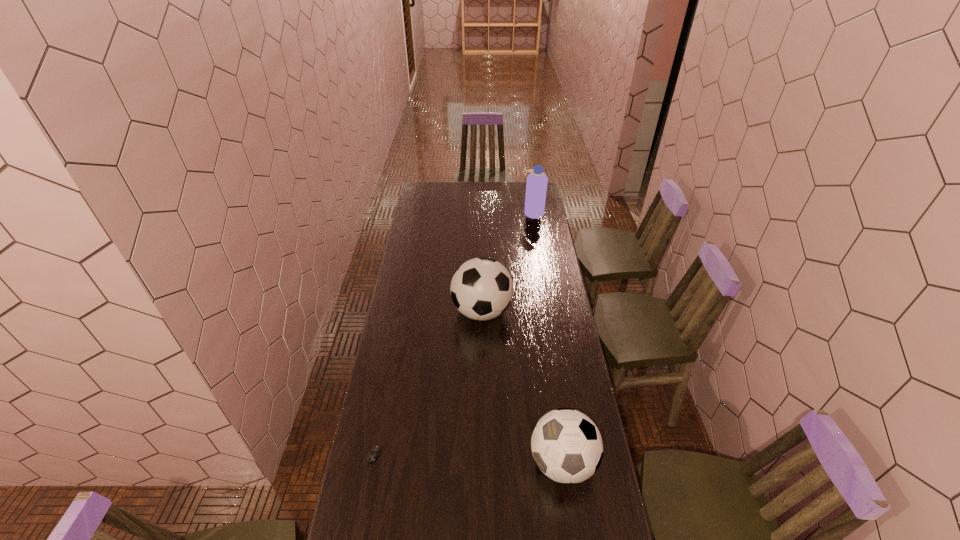
The width and height of the screenshot is (960, 540). What are the coordinates of `the farthest object` in the screenshot? It's located at (536, 186).

Where is `the second farthest object`? This screenshot has height=540, width=960. the second farthest object is located at coordinates (481, 288).

The height and width of the screenshot is (540, 960). I want to click on the farther soccer ball, so click(x=481, y=288).

The image size is (960, 540). I want to click on the right soccer ball, so click(x=566, y=445).

I want to click on the shorter soccer ball, so click(x=566, y=445).

Where is `the shortest object`? Image resolution: width=960 pixels, height=540 pixels. the shortest object is located at coordinates (375, 451).

This screenshot has height=540, width=960. In order to click on computer mouse in this screenshot , I will do `click(375, 451)`.

This screenshot has width=960, height=540. I want to click on free space located 0.340m on the front of the shampoo, so click(540, 254).

Where is `vacant region located 0.190m on the front of the left soccer ball`? This screenshot has height=540, width=960. vacant region located 0.190m on the front of the left soccer ball is located at coordinates (482, 368).

This screenshot has height=540, width=960. In order to click on blank space located 0.250m on the main logo of the shorter soccer ball in this screenshot , I will do `click(457, 462)`.